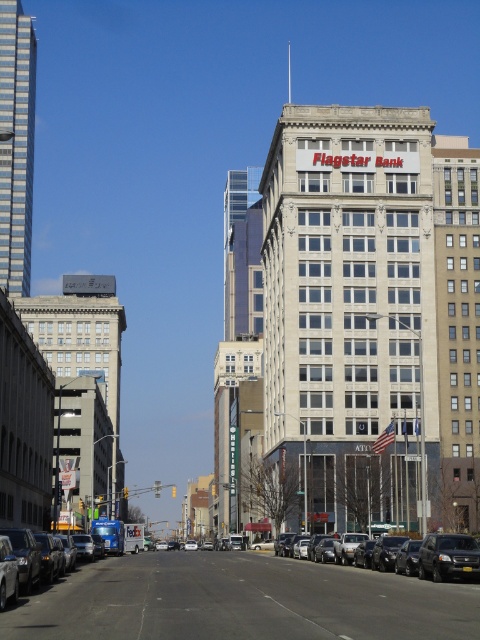
You are a delivery person who needs to park your black glossy sedan at center in a specific spot. The parking spot is located at coordinates point 0.869, 0.894. Can you confirm if your vehicle is already parked correctly in the designated spot?

Yes, the black glossy sedan at center is already parked correctly at point (429, 556) as specified.

You are a delivery person needing to park your vehicle between the black glossy sedan at center and the black matte suv at lower right. Given that your delivery van is 5 meters long, can you fit it in the space between them?

The black glossy sedan at center is larger in size than the black matte suv at lower right, but the exact distance between them isn